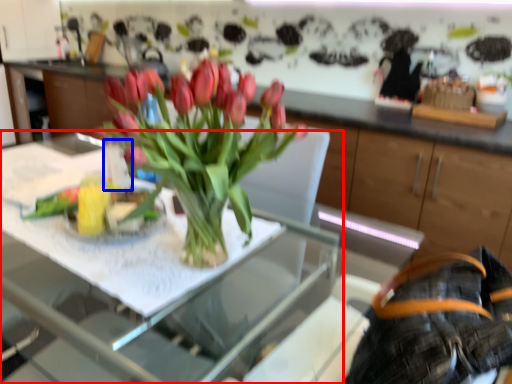
Question: Which object is closer to the camera taking this photo, table (highlighted by a red box) or vase (highlighted by a blue box)?

Choices:
 (A) table
 (B) vase

Answer: (A)